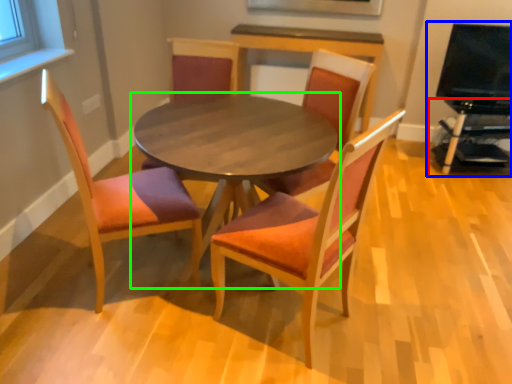
Question: Which object is positioned farthest from entertainment center (highlighted by a red box)? Select from entertainment center (highlighted by a blue box) and coffee table (highlighted by a green box).

Choices:
 (A) entertainment center
 (B) coffee table

Answer: (B)